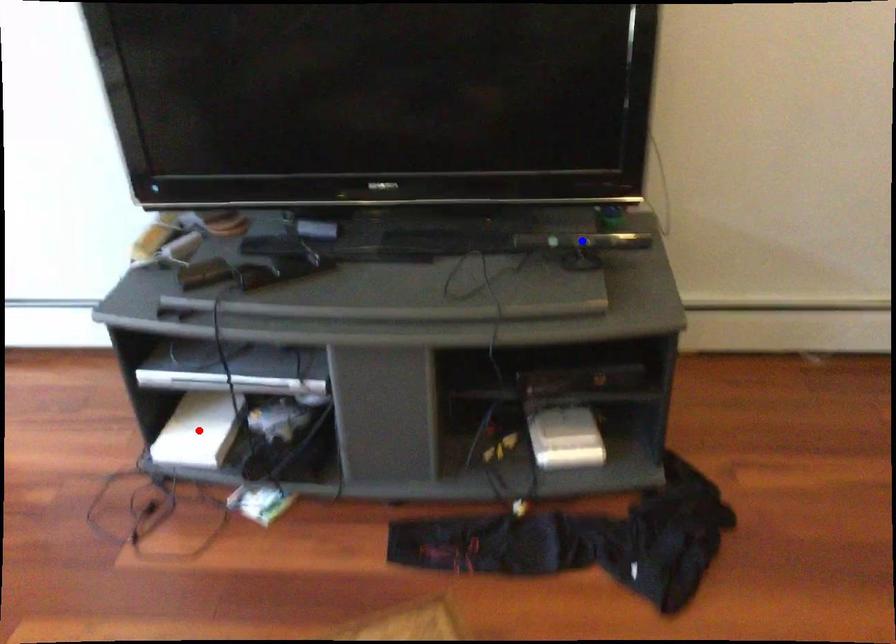
Question: Which of the two points in the image is closer to the camera?

Choices:
 (A) Blue point is closer.
 (B) Red point is closer.

Answer: (A)